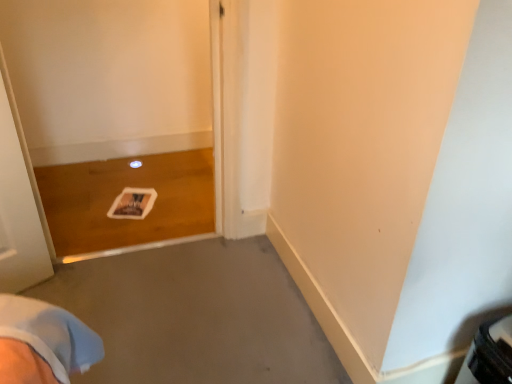
Question: Is white glossy door at lower left oriented away from gray matte concrete at center?

Choices:
 (A) no
 (B) yes

Answer: (A)

Question: Is white glossy door at lower left completely or partially outside of gray matte concrete at center?

Choices:
 (A) no
 (B) yes

Answer: (B)

Question: Can you confirm if white glossy door at lower left is smaller than gray matte concrete at center?

Choices:
 (A) no
 (B) yes

Answer: (A)

Question: Can you confirm if white glossy door at lower left is shorter than gray matte concrete at center?

Choices:
 (A) yes
 (B) no

Answer: (B)

Question: Is white glossy door at lower left positioned far away from gray matte concrete at center?

Choices:
 (A) no
 (B) yes

Answer: (A)

Question: Can you confirm if white glossy door at lower left is positioned to the left of gray matte concrete at center?

Choices:
 (A) no
 (B) yes

Answer: (B)

Question: From the image's perspective, is gray matte concrete at center above white glossy door at lower left?

Choices:
 (A) no
 (B) yes

Answer: (A)

Question: Is gray matte concrete at center thinner than white glossy door at lower left?

Choices:
 (A) no
 (B) yes

Answer: (A)

Question: Is gray matte concrete at center behind white glossy door at lower left?

Choices:
 (A) no
 (B) yes

Answer: (A)

Question: Is gray matte concrete at center bigger than white glossy door at lower left?

Choices:
 (A) no
 (B) yes

Answer: (A)

Question: Is gray matte concrete at center facing away from white glossy door at lower left?

Choices:
 (A) no
 (B) yes

Answer: (A)

Question: Does gray matte concrete at center have a greater width compared to white glossy door at lower left?

Choices:
 (A) no
 (B) yes

Answer: (B)

Question: In the image, is gray matte concrete at center on the left side or the right side of white glossy door at lower left?

Choices:
 (A) right
 (B) left

Answer: (A)